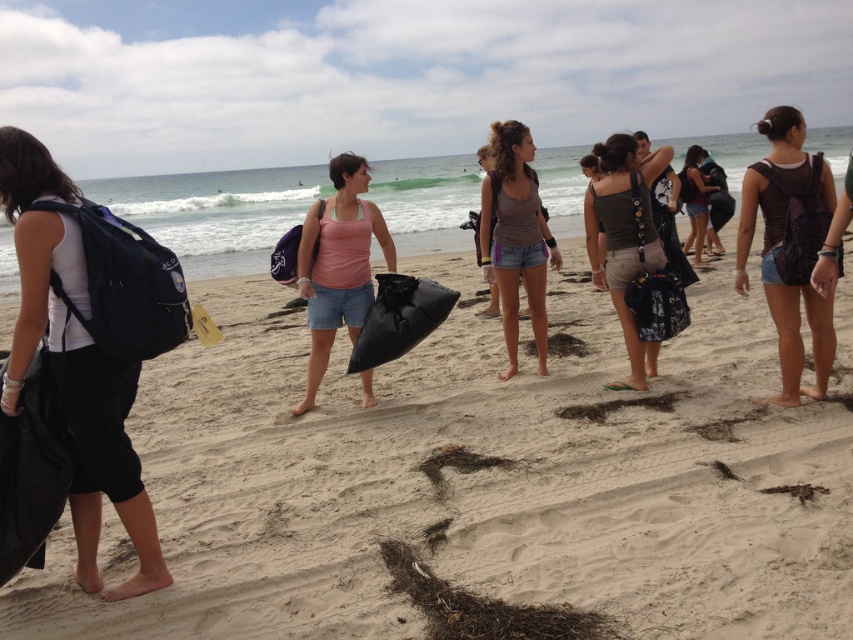
Between black fabric bag at center and black plastic bag at center, which one has more height?

black plastic bag at center is taller.

Between point (131, 429) and point (404, 275), which one is positioned behind?

The point (131, 429) is more distant.

Locate an element on the screen. This screenshot has height=640, width=853. black fabric bag at center is located at coordinates (480, 476).

Can you confirm if black fabric bag at center is wider than matte black backpack at center?

No.

Locate an element on the screen. This screenshot has width=853, height=640. black fabric bag at center is located at coordinates (480, 476).

Is point (393, 596) positioned before point (509, 289)?

Yes, it is.

Locate an element on the screen. black fabric bag at center is located at coordinates (480, 476).

What do you see at coordinates (480, 476) in the screenshot? The height and width of the screenshot is (640, 853). I see `black fabric bag at center` at bounding box center [480, 476].

Where is `black fabric bag at center`? This screenshot has width=853, height=640. black fabric bag at center is located at coordinates [480, 476].